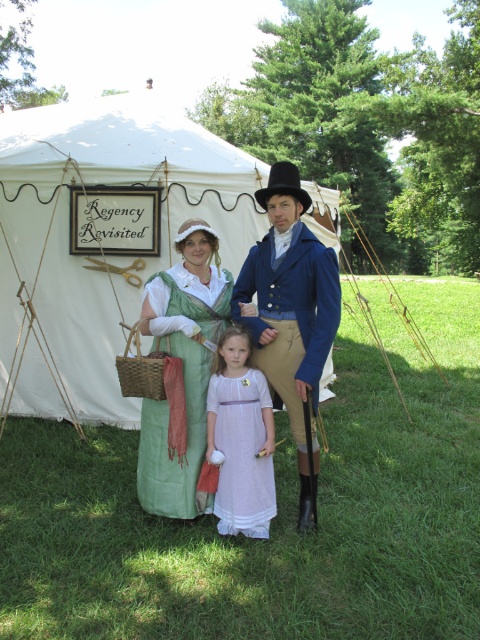
Who is more forward, (104, 298) or (223, 333)?

Positioned in front is point (223, 333).

Which is more to the right, white canvas tent at center or light purple cotton dress at center?

From the viewer's perspective, light purple cotton dress at center appears more on the right side.

Identify the location of white canvas tent at center. The height and width of the screenshot is (640, 480). (101, 237).

In order to click on white canvas tent at center in this screenshot , I will do `click(101, 237)`.

Who is lower down, blue wool coat at center or light purple cotton dress at center?

light purple cotton dress at center

Who is more forward, (288, 269) or (248, 516)?

Point (288, 269)

Image resolution: width=480 pixels, height=640 pixels. What do you see at coordinates (289, 310) in the screenshot?
I see `blue wool coat at center` at bounding box center [289, 310].

I want to click on blue wool coat at center, so click(x=289, y=310).

Is point (253, 385) positioned behind point (259, 195)?

No, it is in front of (259, 195).

Which of these two, light purple cotton dress at center or black felt top hat at upper center, stands taller?

black felt top hat at upper center is taller.

Is point (206, 429) farther from viewer compared to point (276, 188)?

Yes, point (206, 429) is behind point (276, 188).

Where is `light purple cotton dress at center`? light purple cotton dress at center is located at coordinates (x=240, y=440).